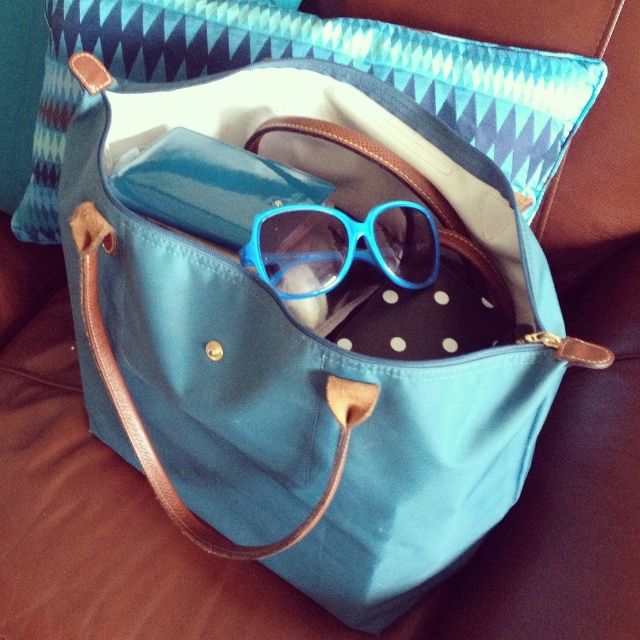
You are trying to place a teal zigzag fabric pillow at upper center on a shelf that is 0.5 meters wide. Can you fit it if the pillow is positioned at point 0.091, 0.489?

The teal zigzag fabric pillow at upper center is positioned at point (312, 58), which is within the 0.5 meters width of the shelf, so it can be placed there.

Consider the image. You are taking a photo of the open teal tote bag and notice two points marked as point (166, 65) and point (394, 204). Which point is closer to the camera in the image?

Point (166, 65) is closer to the camera than point (394, 204).

You are organizing your bag and need to access the blue matte sunglasses at center. Can you reach them without moving the teal zigzag fabric pillow at upper center?

The teal zigzag fabric pillow at upper center is located above the blue matte sunglasses at center, so you can reach the sunglasses without moving the pillow.